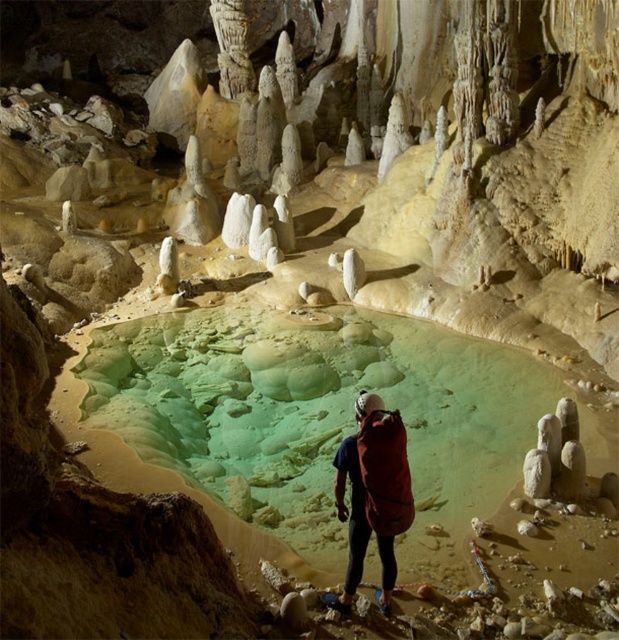
Question: Can you confirm if green translucent water at center is smaller than matte orange backpack at center?

Choices:
 (A) yes
 (B) no

Answer: (A)

Question: Does green translucent water at center appear over matte orange backpack at center?

Choices:
 (A) yes
 (B) no

Answer: (B)

Question: Which object is farther from the camera taking this photo?

Choices:
 (A) matte orange backpack at center
 (B) green translucent water at center

Answer: (B)

Question: Which object is closer to the camera taking this photo?

Choices:
 (A) matte orange backpack at center
 (B) green translucent water at center

Answer: (A)

Question: Can you confirm if green translucent water at center is positioned to the left of matte orange backpack at center?

Choices:
 (A) no
 (B) yes

Answer: (A)

Question: Which object appears farthest from the camera in this image?

Choices:
 (A) matte orange backpack at center
 (B) green translucent water at center

Answer: (B)